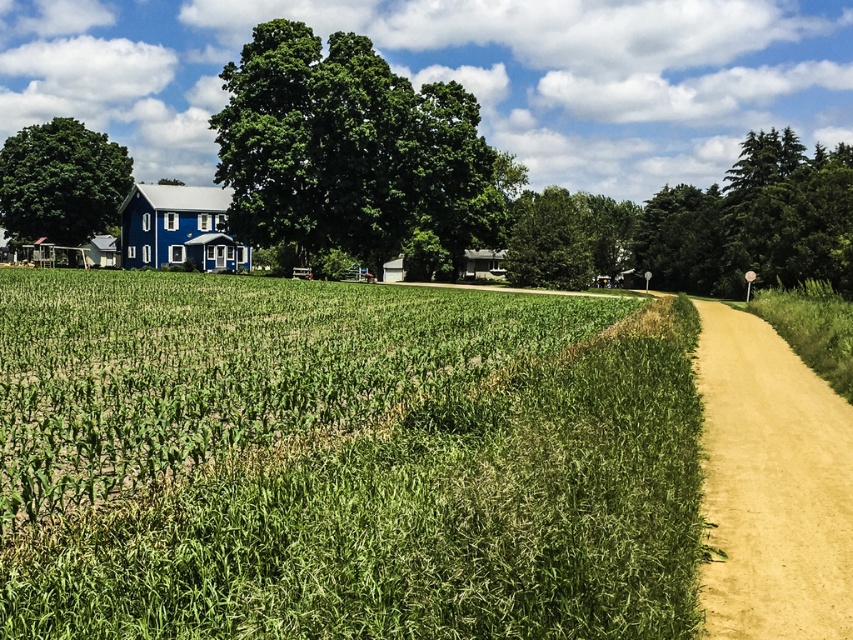
Question: Does green leafy tree at upper center have a lesser width compared to green leafy tree at upper right?

Choices:
 (A) yes
 (B) no

Answer: (A)

Question: Which object appears farthest from the camera in this image?

Choices:
 (A) green leafy tree at center
 (B) green grassy corn field at center
 (C) dirt road at right
 (D) green leafy tree at left

Answer: (D)

Question: Which point is farther from the camera taking this photo?

Choices:
 (A) (381, 232)
 (B) (643, 208)
 (C) (221, 250)
 (D) (65, 168)

Answer: (B)

Question: Estimate the real-world distances between objects in this image. Which object is closer to the dirt road at right?

Choices:
 (A) green leafy tree at center
 (B) blue wooden barn at center
 (C) green leafy tree at upper center
 (D) green grassy corn field at center

Answer: (D)

Question: Can you confirm if green leafy tree at upper right is positioned below green leafy tree at center?

Choices:
 (A) no
 (B) yes

Answer: (B)

Question: Does green grassy corn field at center appear on the left side of dirt road at right?

Choices:
 (A) yes
 (B) no

Answer: (A)